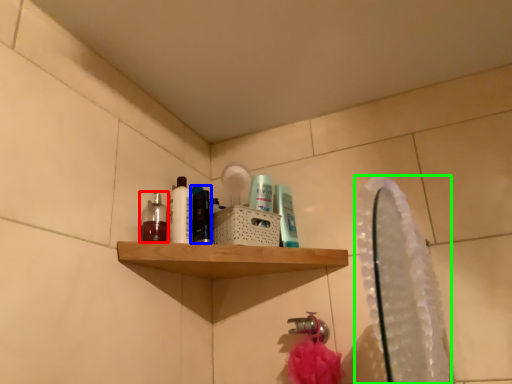
Question: Which object is positioned closest to mouthwash (highlighted by a red box)? Select from mouthwash (highlighted by a blue box) and mirror (highlighted by a green box).

Choices:
 (A) mouthwash
 (B) mirror

Answer: (A)